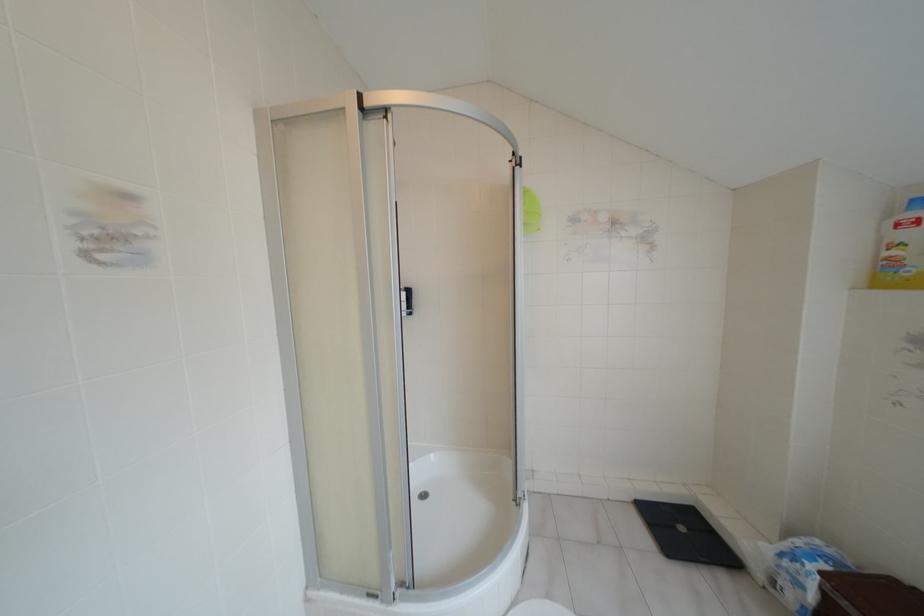
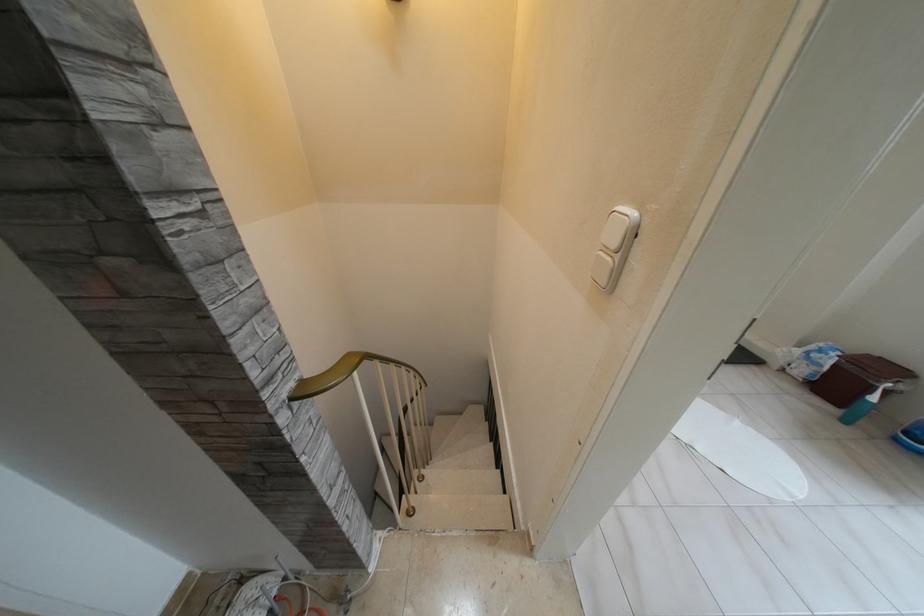
Question: The images are taken continuously from a first-person perspective. In which direction are you moving?

Choices:
 (A) Left
 (B) Right
 (C) Forward
 (D) Backward

Answer: (A)